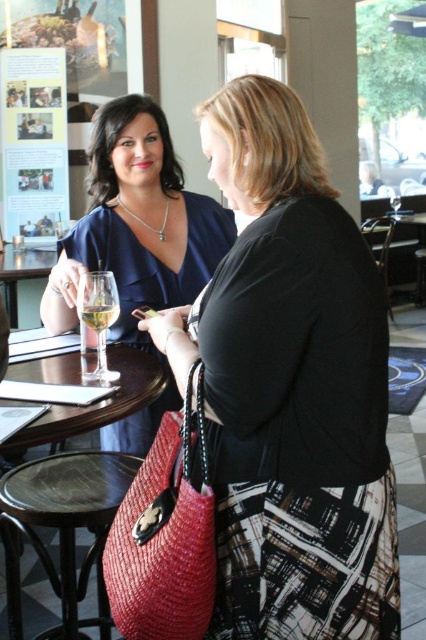
You are a photographer planning to take a photo of the matte blue dress at upper left and the transparent glass table at center. Which object should you focus on first if you want to capture both in the same frame without moving the camera?

The matte blue dress at upper left is taller than the transparent glass table at center, so you should focus on the taller object first to ensure it fits within the frame.

You are a waiter at the restaurant and need to deliver a dessert to the table where the clear glass at center and wooden stool at lower center are located. Where should you place the dessert plate?

The clear glass at center is below the wooden stool at lower center, so the dessert plate should be placed on the wooden stool at lower center to avoid blocking the glass.

You are a photographer who needs to take a photo of the matte blue dress at upper left and the camera. The minimum distance required between the two objects for the camera to focus properly is 5 feet. Can you take the photo without moving either object?

The matte blue dress at upper left and camera are 5.06 feet apart, which is more than the minimum required distance of 5 feet. Therefore, the photographer can take the photo without moving either object.